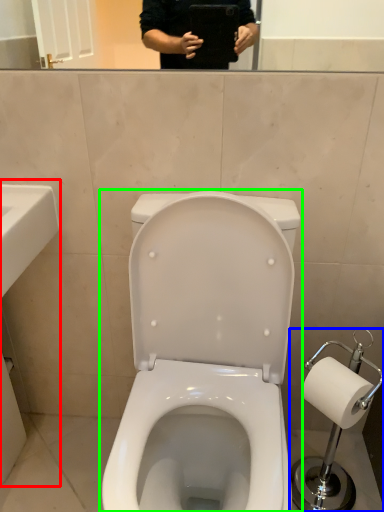
Question: Which object is positioned closest to sink (highlighted by a red box)? Select from scale (highlighted by a blue box) and toilet (highlighted by a green box).

Choices:
 (A) scale
 (B) toilet

Answer: (B)